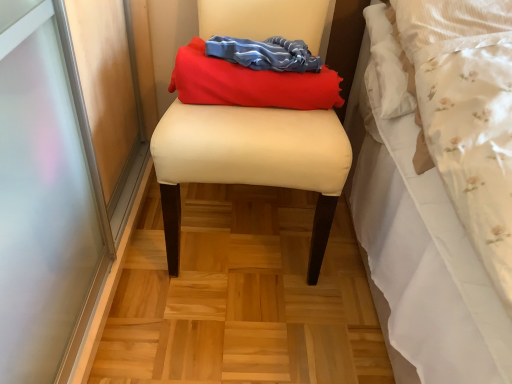
Question: From a real-world perspective, is beige fabric stool at center located beneath matte red fabric at center?

Choices:
 (A) no
 (B) yes

Answer: (B)

Question: Is beige fabric stool at center aimed at matte red fabric at center?

Choices:
 (A) yes
 (B) no

Answer: (A)

Question: Is beige fabric stool at center located outside matte red fabric at center?

Choices:
 (A) no
 (B) yes

Answer: (B)

Question: Can matte red fabric at center be found inside beige fabric stool at center?

Choices:
 (A) no
 (B) yes

Answer: (B)

Question: Considering the relative positions of beige fabric stool at center and matte red fabric at center in the image provided, is beige fabric stool at center to the left of matte red fabric at center from the viewer's perspective?

Choices:
 (A) no
 (B) yes

Answer: (B)

Question: Is beige fabric stool at center turned away from matte red fabric at center?

Choices:
 (A) yes
 (B) no

Answer: (A)

Question: Is matte red fabric at center outside beige fabric stool at center?

Choices:
 (A) yes
 (B) no

Answer: (B)

Question: Is matte red fabric at center thinner than beige fabric stool at center?

Choices:
 (A) yes
 (B) no

Answer: (A)

Question: Is matte red fabric at center oriented away from beige fabric stool at center?

Choices:
 (A) no
 (B) yes

Answer: (B)

Question: Is matte red fabric at center positioned far away from beige fabric stool at center?

Choices:
 (A) yes
 (B) no

Answer: (B)

Question: Is matte red fabric at center shorter than beige fabric stool at center?

Choices:
 (A) no
 (B) yes

Answer: (B)

Question: Is matte red fabric at center bigger than beige fabric stool at center?

Choices:
 (A) yes
 (B) no

Answer: (B)

Question: From the image's perspective, is beige fabric stool at center located above or below matte red fabric at center?

Choices:
 (A) below
 (B) above

Answer: (A)